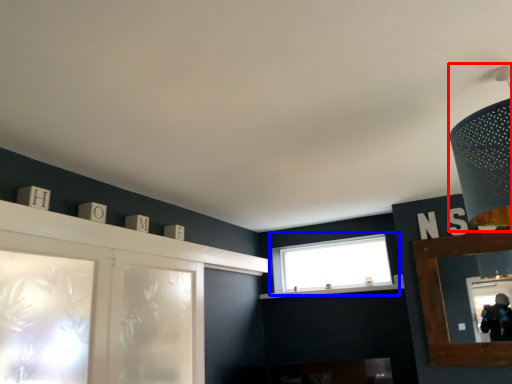
Question: Which object is closer to the camera taking this photo, light fixture (highlighted by a red box) or window (highlighted by a blue box)?

Choices:
 (A) light fixture
 (B) window

Answer: (A)